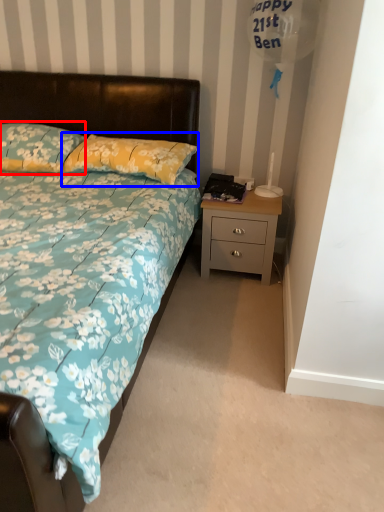
Question: Which object is closer to the camera taking this photo, pillow (highlighted by a red box) or pillow (highlighted by a blue box)?

Choices:
 (A) pillow
 (B) pillow

Answer: (B)